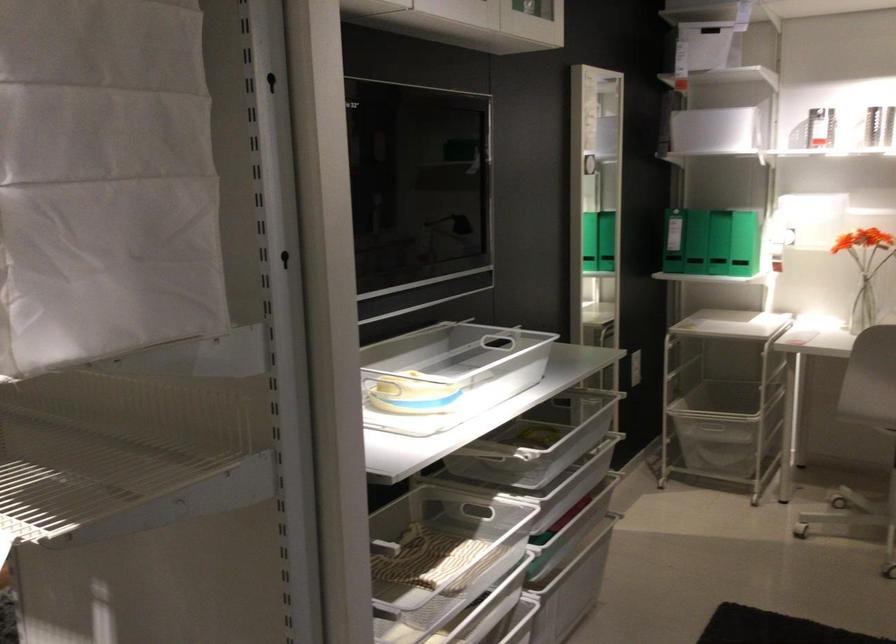
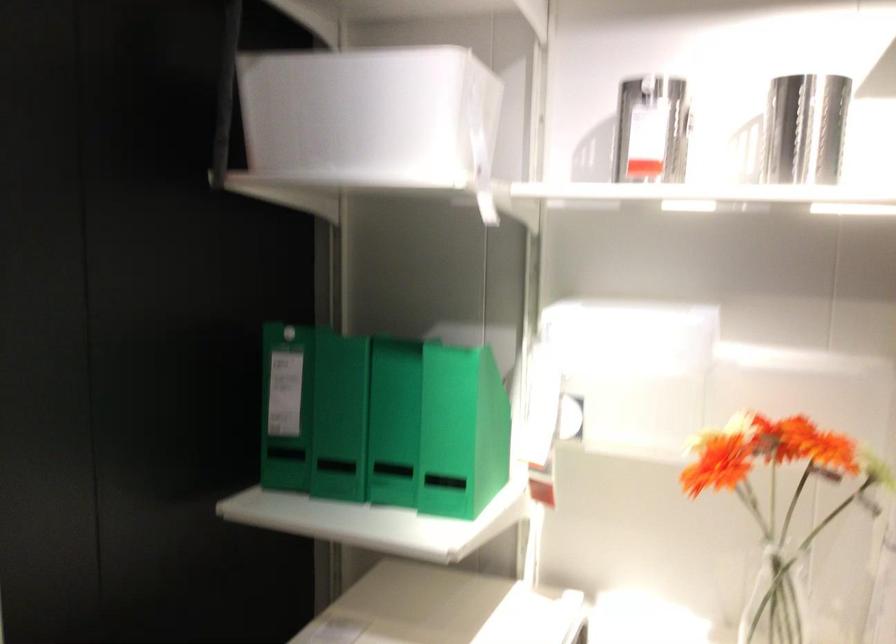
What movement of the cameraman would produce the second image?

The cameraman moved toward right, forward.